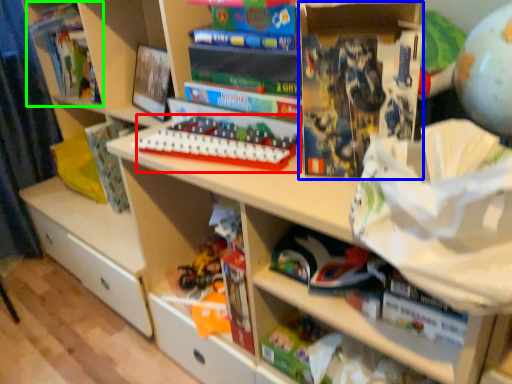
Question: Estimate the real-world distances between objects in this image. Which object is closer to toy (highlighted by a red box), paperback book (highlighted by a blue box) or book (highlighted by a green box)?

Choices:
 (A) paperback book
 (B) book

Answer: (A)